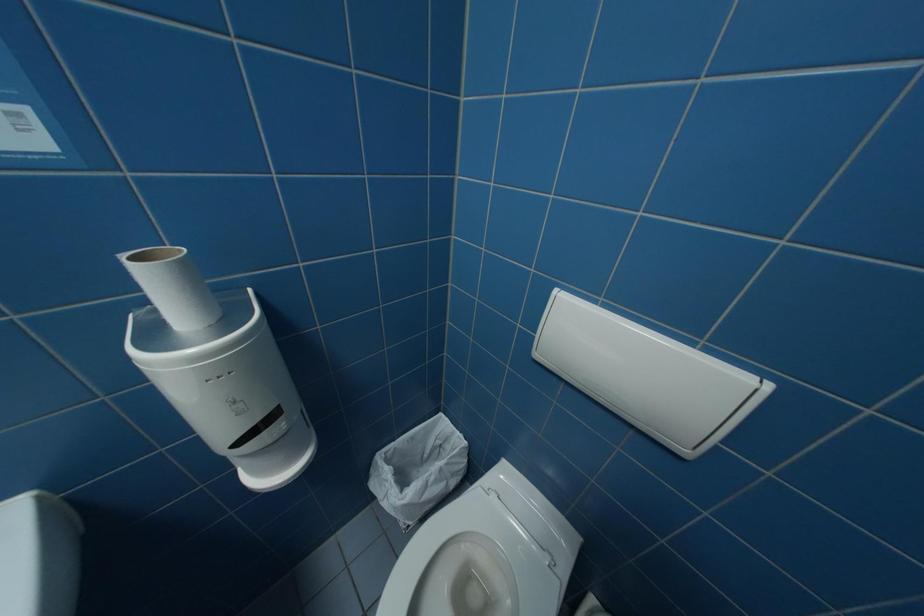
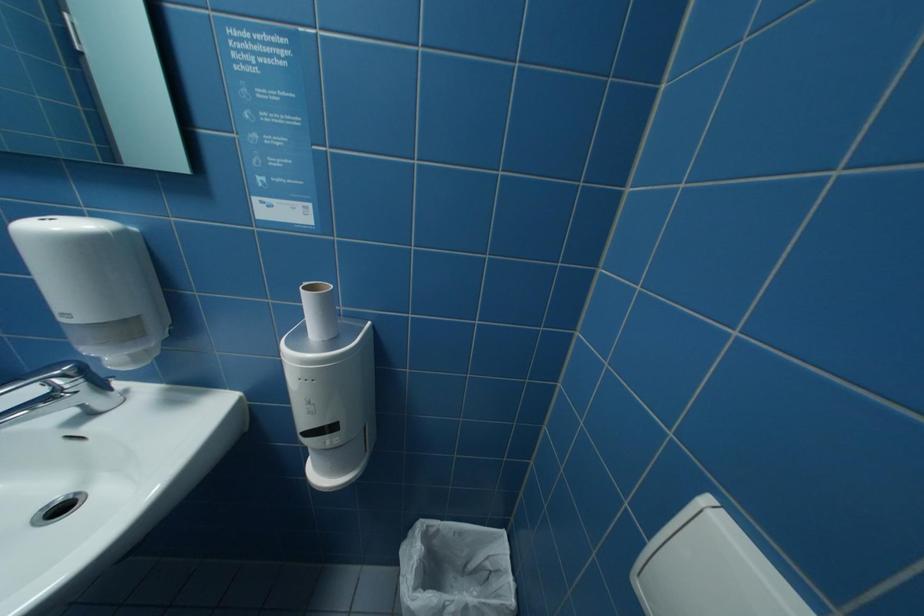
Question: The images are taken continuously from a first-person perspective. In which direction is your viewpoint rotating?

Choices:
 (A) Left
 (B) Right
 (C) Up
 (D) Down

Answer: (A)